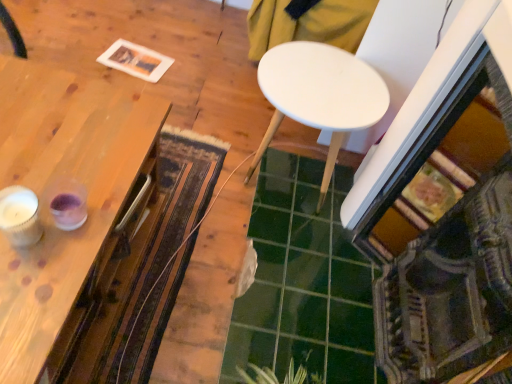
What is the approximate height of wooden table at left, marked as the first table in a left-to-right arrangement?

wooden table at left, marked as the first table in a left-to-right arrangement, is 20.99 inches tall.

The width and height of the screenshot is (512, 384). What do you see at coordinates (69, 212) in the screenshot?
I see `wooden table at left, the second table viewed from the right` at bounding box center [69, 212].

This screenshot has width=512, height=384. What do you see at coordinates (319, 95) in the screenshot?
I see `white matte table at center, which appears as the 1th table when viewed from the right` at bounding box center [319, 95].

Where is `white matte table at center, marked as the 2th table in a left-to-right arrangement`? The height and width of the screenshot is (384, 512). white matte table at center, marked as the 2th table in a left-to-right arrangement is located at coordinates 319,95.

The height and width of the screenshot is (384, 512). I want to click on textured woolen mat at center, so click(x=145, y=267).

This screenshot has height=384, width=512. Identify the location of white textured candle at left. (20, 216).

At what (x,y) coordinates should I click in order to perform the action: click on wooden table at left, the second table viewed from the right. Please return your answer as a coordinate pair (x, y). The image size is (512, 384). Looking at the image, I should click on (69, 212).

What are the coordinates of `mat located underneath the white matte table at center, marked as the 2th table in a left-to-right arrangement (from a real-world perspective)` in the screenshot? It's located at (145, 267).

Is point (377, 73) farther from viewer compared to point (77, 336)?

Yes, it is behind point (77, 336).

Does white matte table at center, marked as the 2th table in a left-to-right arrangement, appear on the right side of textured woolen mat at center?

Indeed, white matte table at center, marked as the 2th table in a left-to-right arrangement, is positioned on the right side of textured woolen mat at center.

From a real-world perspective, is green glossy tile at center on wooden table at left, marked as the first table in a left-to-right arrangement?

Incorrect, from a real-world perspective, green glossy tile at center is lower than wooden table at left, marked as the first table in a left-to-right arrangement.

Looking at this image, from their relative heights in the image, would you say green glossy tile at center is taller or shorter than wooden table at left, marked as the first table in a left-to-right arrangement?

Clearly, green glossy tile at center is shorter compared to wooden table at left, marked as the first table in a left-to-right arrangement.

Can you tell me how much green glossy tile at center and wooden table at left, marked as the first table in a left-to-right arrangement, differ in facing direction?

green glossy tile at center and wooden table at left, marked as the first table in a left-to-right arrangement, are facing 88.1 degrees away from each other.

Which is more to the left, textured woolen mat at center or green glossy tile at center?

From the viewer's perspective, textured woolen mat at center appears more on the left side.

From a real-world perspective, is textured woolen mat at center located higher than green glossy tile at center?

Incorrect, from a real-world perspective, textured woolen mat at center is lower than green glossy tile at center.

Considering the points (169, 301) and (360, 329), which point is behind, point (169, 301) or point (360, 329)?

The point (360, 329) is farther.

What's the angular difference between green glossy tile at center and white matte table at center, marked as the 2th table in a left-to-right arrangement,'s facing directions?

The facing directions of green glossy tile at center and white matte table at center, marked as the 2th table in a left-to-right arrangement, are 1.67 degrees apart.

Does green glossy tile at center lie behind white matte table at center, marked as the 2th table in a left-to-right arrangement?

No, green glossy tile at center is closer to the viewer.

Measure the distance between green glossy tile at center and white matte table at center, marked as the 2th table in a left-to-right arrangement.

19.44 inches.

Is green glossy tile at center oriented away from white matte table at center, which appears as the 1th table when viewed from the right?

No, green glossy tile at center is not facing the opposite direction of white matte table at center, which appears as the 1th table when viewed from the right.

Measure the distance from wooden table at left, marked as the first table in a left-to-right arrangement, to green glossy tile at center.

wooden table at left, marked as the first table in a left-to-right arrangement, and green glossy tile at center are 22.69 inches apart.

Is wooden table at left, the second table viewed from the right, to the left of green glossy tile at center from the viewer's perspective?

Yes.

Is point (76, 309) closer to camera compared to point (289, 213)?

Yes, point (76, 309) is closer to viewer.

Is wooden table at left, marked as the first table in a left-to-right arrangement, looking in the opposite direction of green leafy plant at lower center?

No.

How many degrees apart are the facing directions of wooden table at left, the second table viewed from the right, and green leafy plant at lower center?

86.2 degrees.

Does wooden table at left, the second table viewed from the right, appear on the left side of green leafy plant at lower center?

Yes, wooden table at left, the second table viewed from the right, is to the left of green leafy plant at lower center.

How much distance is there between wooden table at left, marked as the first table in a left-to-right arrangement, and green leafy plant at lower center?

59.32 centimeters.

Considering the positions of point (340, 347) and point (296, 374), is point (340, 347) closer or farther from the camera than point (296, 374)?

Point (340, 347).

From a real-world perspective, is green glossy tile at center over green leafy plant at lower center?

Incorrect, from a real-world perspective, green glossy tile at center is lower than green leafy plant at lower center.

Does green glossy tile at center appear on the left side of green leafy plant at lower center?

Incorrect, green glossy tile at center is not on the left side of green leafy plant at lower center.

Is green glossy tile at center placed right next to green leafy plant at lower center?

green glossy tile at center and green leafy plant at lower center are clearly separated.

This screenshot has height=384, width=512. I want to click on table behind the textured woolen mat at center, so click(x=319, y=95).

In order to click on tile that is under the wooden table at left, the second table viewed from the right (from a real-world perspective) in this screenshot , I will do `click(303, 281)`.

Which object lies further to the anchor point white textured candle at left, textured woolen mat at center or white matte table at center, which appears as the 1th table when viewed from the right?

Based on the image, white matte table at center, which appears as the 1th table when viewed from the right, appears to be further to white textured candle at left.

Considering their positions, is green glossy tile at center positioned further to green leafy plant at lower center than white matte table at center, which appears as the 1th table when viewed from the right?

white matte table at center, which appears as the 1th table when viewed from the right, is further to green leafy plant at lower center.

Based on their spatial positions, is white textured candle at left or wooden table at left, the second table viewed from the right, further from textured woolen mat at center?

The object further to textured woolen mat at center is white textured candle at left.

In the scene shown: Looking at the image, which one is located closer to wooden table at left, marked as the first table in a left-to-right arrangement, white matte table at center, marked as the 2th table in a left-to-right arrangement, or white textured candle at left?

Among the two, white textured candle at left is located nearer to wooden table at left, marked as the first table in a left-to-right arrangement.

Estimate the real-world distances between objects in this image. Which object is further from white matte table at center, which appears as the 1th table when viewed from the right, white textured candle at left or wooden table at left, marked as the first table in a left-to-right arrangement?

white textured candle at left is further to white matte table at center, which appears as the 1th table when viewed from the right.

From the image, which object appears to be farther from textured woolen mat at center, green leafy plant at lower center or wooden table at left, marked as the first table in a left-to-right arrangement?

Based on the image, green leafy plant at lower center appears to be further to textured woolen mat at center.

Considering their positions, is white textured candle at left positioned closer to green leafy plant at lower center than wooden table at left, marked as the first table in a left-to-right arrangement?

wooden table at left, marked as the first table in a left-to-right arrangement.

Considering their positions, is white textured candle at left positioned further to green glossy tile at center than white matte table at center, which appears as the 1th table when viewed from the right?

white textured candle at left is further to green glossy tile at center.

Image resolution: width=512 pixels, height=384 pixels. Identify the location of plant situated between wooden table at left, marked as the first table in a left-to-right arrangement, and green glossy tile at center from left to right. (276, 376).

Where is `mat between white textured candle at left and green glossy tile at center`? This screenshot has height=384, width=512. mat between white textured candle at left and green glossy tile at center is located at coordinates (145, 267).

Identify the location of candle holder between wooden table at left, marked as the first table in a left-to-right arrangement, and white matte table at center, marked as the 2th table in a left-to-right arrangement, from left to right. This screenshot has width=512, height=384. (20, 216).

Locate an element on the screen. The width and height of the screenshot is (512, 384). mat between white matte table at center, marked as the 2th table in a left-to-right arrangement, and green leafy plant at lower center in the up-down direction is located at coordinates (145, 267).